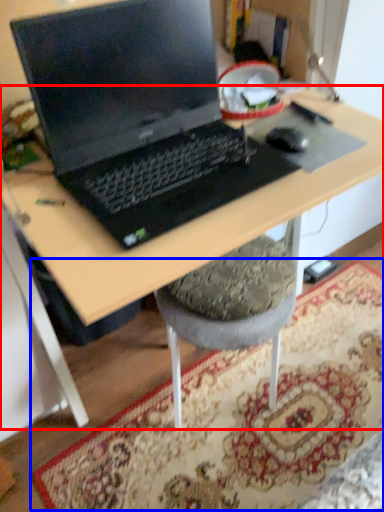
Question: Among these objects, which one is farthest to the camera, desk (highlighted by a red box) or mat (highlighted by a blue box)?

Choices:
 (A) desk
 (B) mat

Answer: (B)